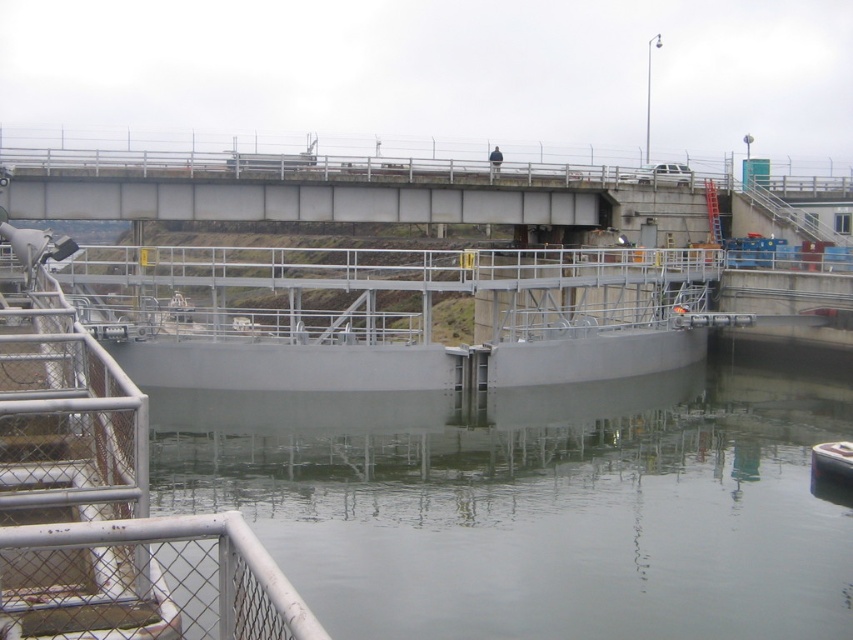
Based on the photo, can you confirm if gray metallic water at center is positioned to the left of metallic gray boat at lower right?

Indeed, gray metallic water at center is positioned on the left side of metallic gray boat at lower right.

The height and width of the screenshot is (640, 853). What are the coordinates of `gray metallic water at center` in the screenshot? It's located at (537, 500).

Does point (374, 442) come behind point (849, 452)?

Yes, it is.

Locate an element on the screen. gray metallic water at center is located at coordinates (537, 500).